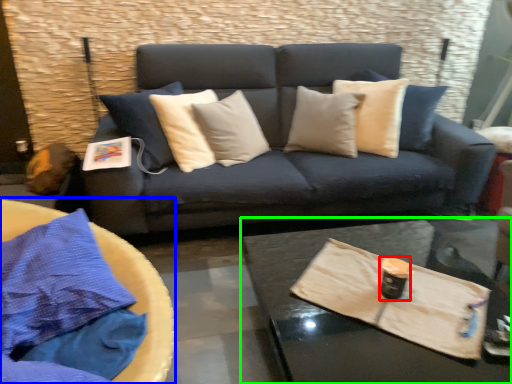
Question: Based on their relative distances, which object is nearer to beverage (highlighted by a red box)? Choose from round table (highlighted by a blue box) and coffee table (highlighted by a green box).

Choices:
 (A) round table
 (B) coffee table

Answer: (B)